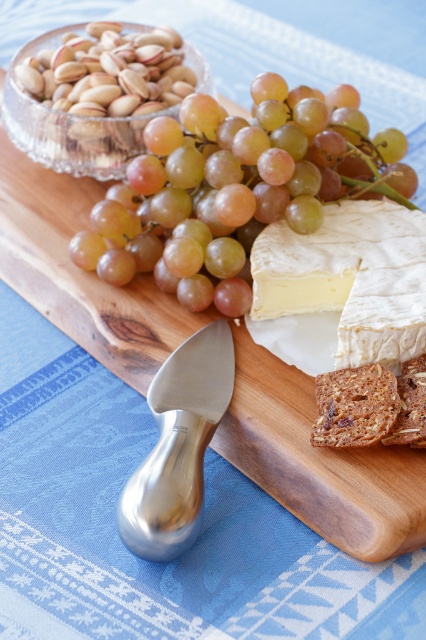
You are planning to place a small decorative bowl on the charcuterie board. The bowl is 10 cm in height. Considering the green matte grape at center and the white creamy cheese at center, which item would allow the bowl to be placed without blocking the view of the other?

The green matte grape at center is much taller than the white creamy cheese at center. Therefore, placing the bowl on the white creamy cheese at center would be better as it is shorter, allowing the bowl to not block the view of the taller grape.

You are looking at the charcuterie board from above. Where is the white creamy cheese at center located in terms of its 2D coordinates?

The white creamy cheese at center is located at the 2D coordinates of point (342, 288).

You are a food stylist arranging a charcuterie board. You have a white creamy cheese at center and a point marked at coordinates (342, 288). Where is this point located in relation to the cheese?

The point at coordinates (342, 288) is on the white creamy cheese at center.